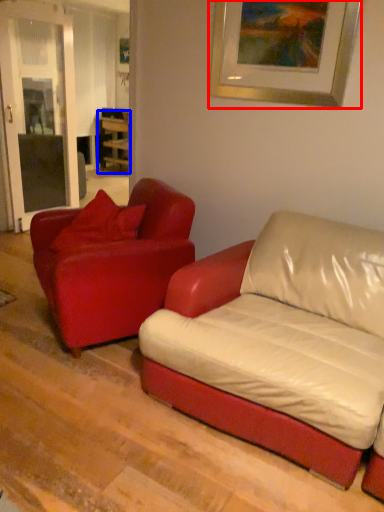
Question: Among these objects, which one is farthest to the camera, picture frame (highlighted by a red box) or table (highlighted by a blue box)?

Choices:
 (A) picture frame
 (B) table

Answer: (B)